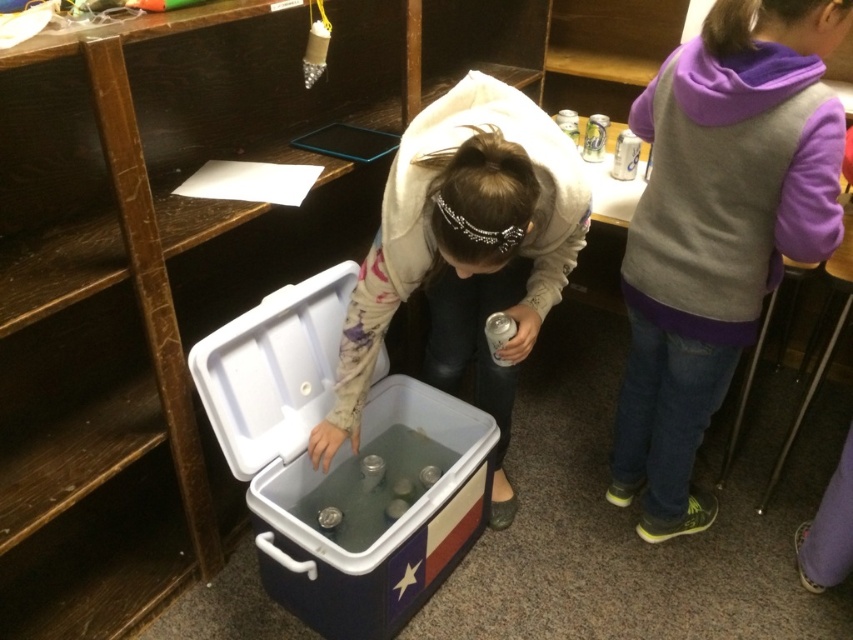
You are a student in the classroom and need to reach both the blue plastic cooler at center and the white plastic cooler at center. Which cooler should you approach first to get closer to both?

You should approach the blue plastic cooler at center first since it is in front of the white plastic cooler at center, so reaching it first allows you to access both without needing to move past the white one first.

You are a student in the classroom and you need to place a book between the blue plastic cooler at center and the white plastic cooler at center. Can you do it?

The blue plastic cooler at center is 10.71 inches away from the white plastic cooler at center. Since the distance between them is more than the width of a typical book, you can place the book between them.

You are a student in the classroom and need to store your purple fleece vest at right and blue plastic cooler at center in your locker. Which item can you place first into the locker if the opening is narrow and you can only fit one item at a time?

The purple fleece vest at right is thinner than the blue plastic cooler at center, so you can place the purple fleece vest at right first into the locker since it requires less width to fit through the narrow opening.